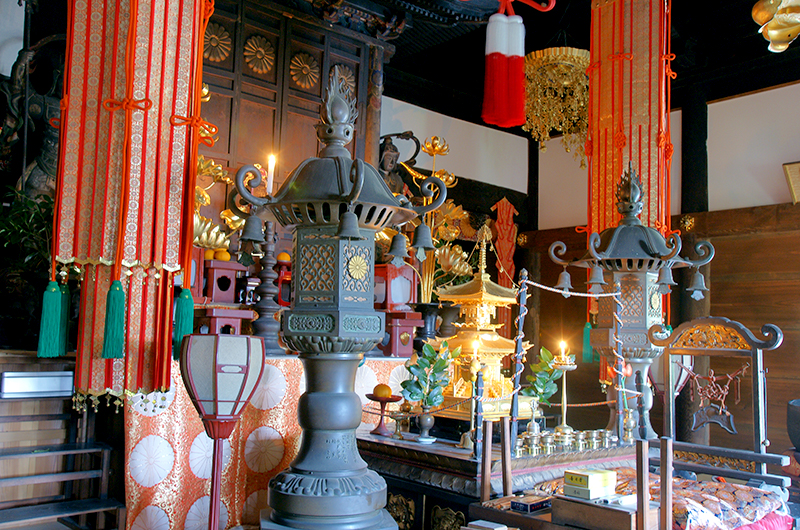
This screenshot has width=800, height=530. Find the location of `candle`. candle is located at coordinates [x=570, y=342], [x=272, y=167].